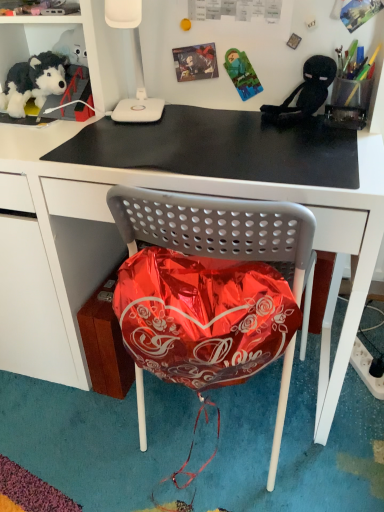
Find the location of a particular element. Image resolution: width=384 pixels, height=512 pixels. free area in between black matte desk at center and metallic red balloon at center is located at coordinates (124, 419).